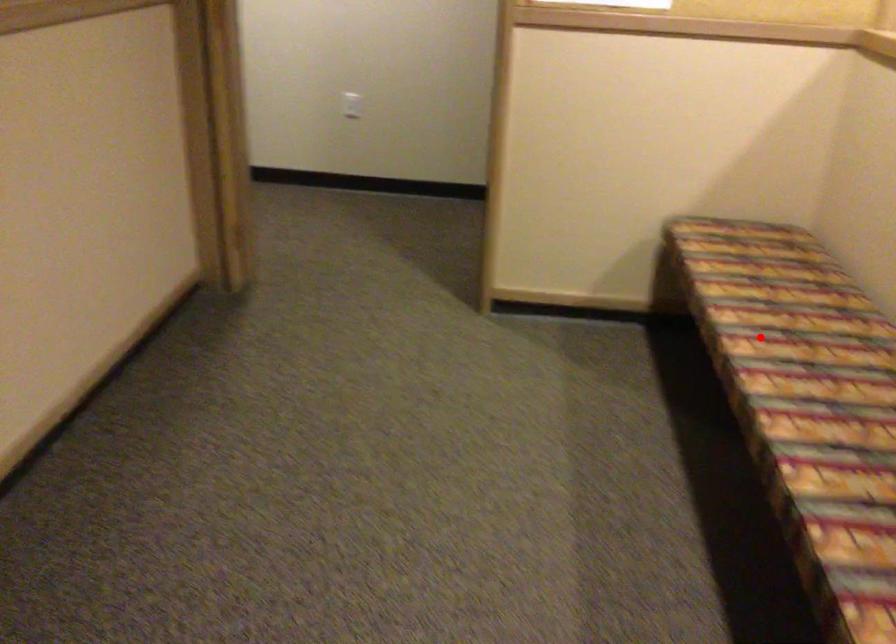
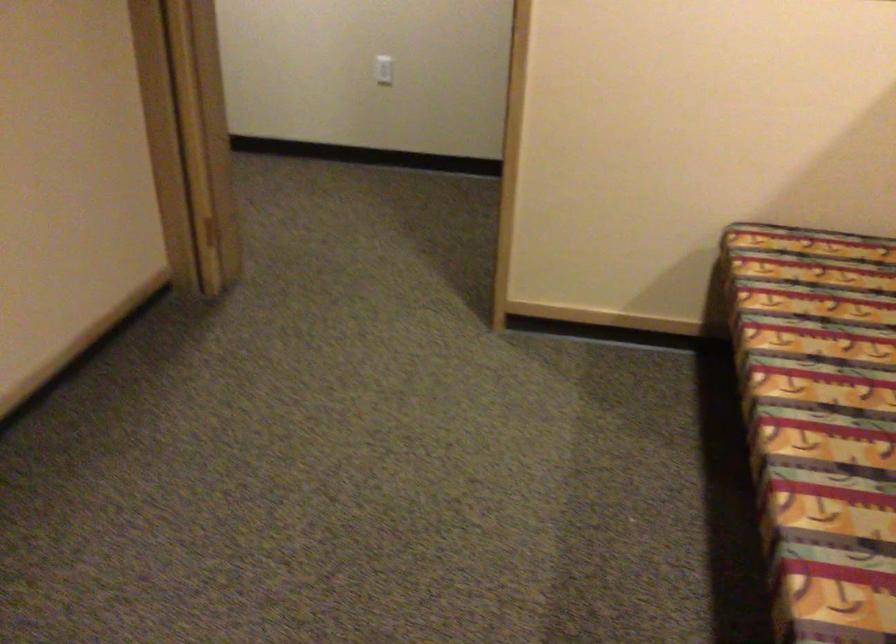
Question: I am providing you with two images of the same scene from different viewpoints. A red point is shown in image1. For the corresponding object point in image2, is it positioned nearer or farther from the camera?

Choices:
 (A) Nearer
 (B) Farther

Answer: (A)